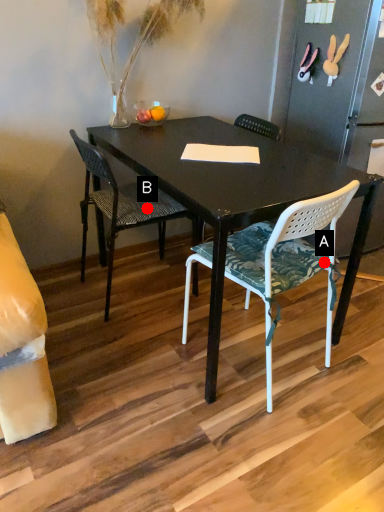
Question: Two points are circled on the image, labeled by A and B beside each circle. Which point is farther to the camera?

Choices:
 (A) A is further
 (B) B is further

Answer: (B)